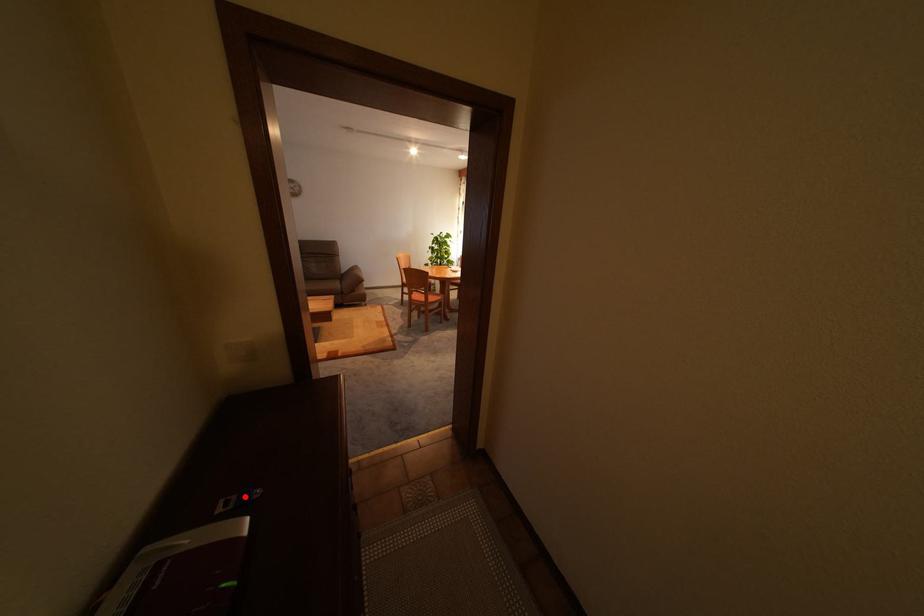
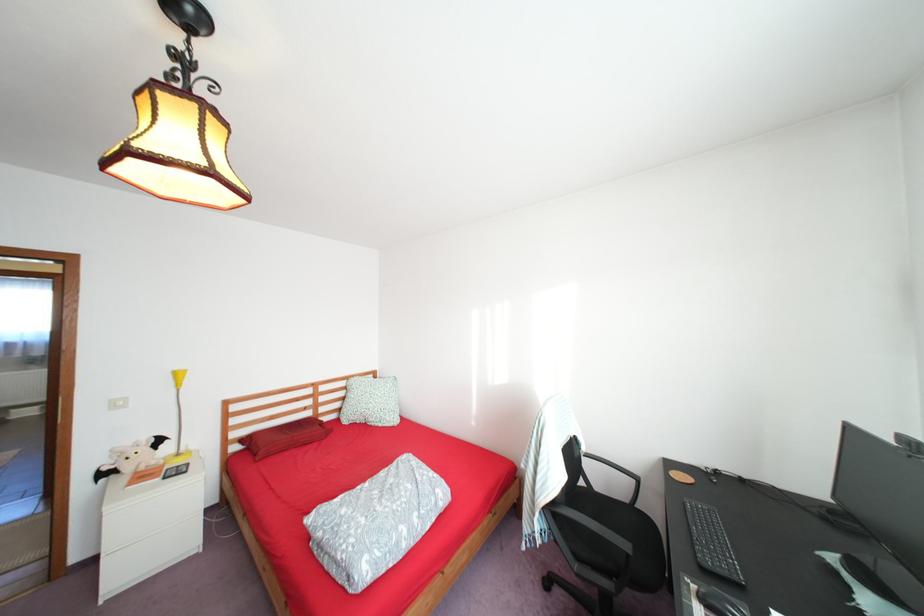
Question: I am providing you with two images of the same scene from different viewpoints. A red point is marked on the first image. Is the red point's position out of view in image 2?

Choices:
 (A) Yes
 (B) No

Answer: (A)